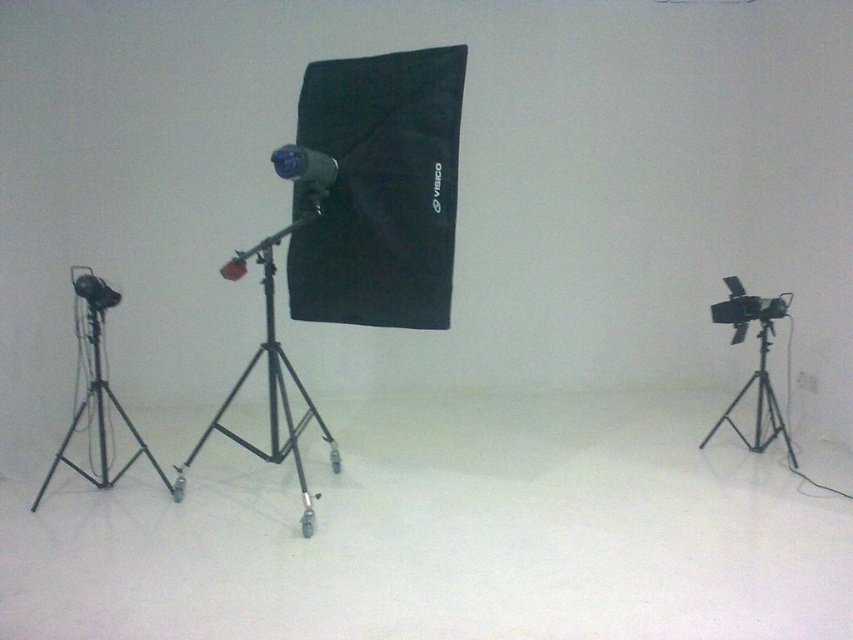
Between point (102, 477) and point (756, 401), which one is positioned in front?

Point (102, 477) is in front.

Locate an element on the screen. This screenshot has width=853, height=640. matte black tripod at left is located at coordinates (97, 422).

Who is positioned more to the right, matte black tripod at left or matte black camera at center?

From the viewer's perspective, matte black camera at center appears more on the right side.

Does matte black tripod at left have a smaller size compared to matte black camera at center?

No.

You are a GUI agent. You are given a task and a screenshot of the screen. Output one action in this format:
    pyautogui.click(x=<x>, y=<y>)
    Task: Click on the matte black tripod at left
    This screenshot has height=640, width=853.
    Given the screenshot: What is the action you would take?
    pyautogui.click(x=97, y=422)

Find the location of a particular element. matte black tripod at left is located at coordinates (97, 422).

Which is above, black matte tripod at center or matte black tripod at left?

matte black tripod at left is above.

Can you confirm if black matte tripod at center is wider than matte black tripod at left?

No.

Measure the distance between black matte tripod at center and camera.

black matte tripod at center is 3.05 meters away from camera.

This screenshot has width=853, height=640. Identify the location of black matte tripod at center. (268, 385).